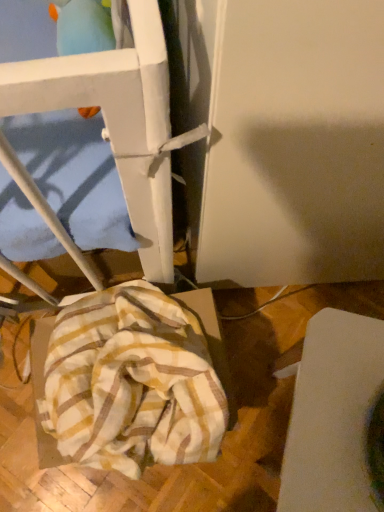
What do you see at coordinates (130, 382) in the screenshot? This screenshot has width=384, height=512. I see `plaid fabric at center` at bounding box center [130, 382].

Identify the location of plaid fabric at center. (130, 382).

Locate an element on the screen. plaid fabric at center is located at coordinates (130, 382).